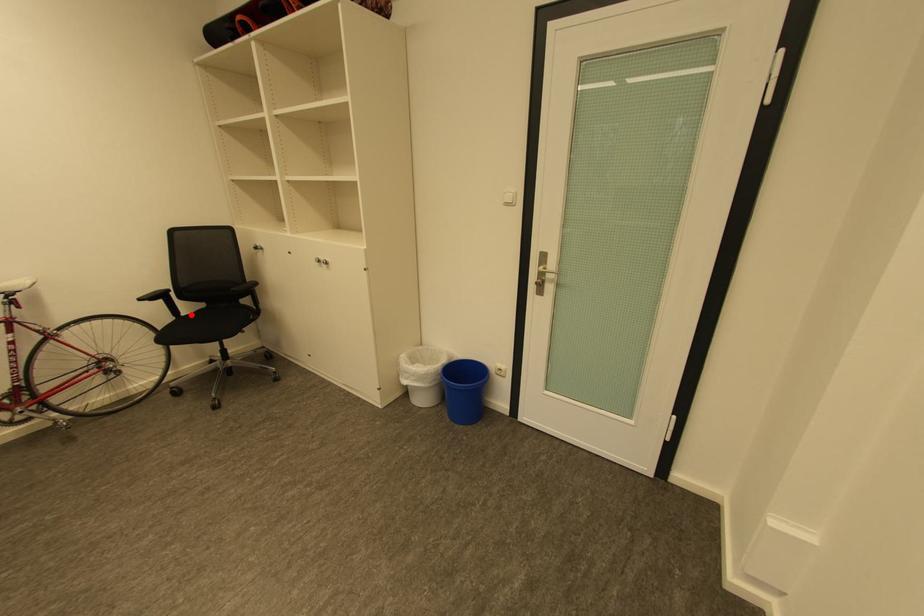
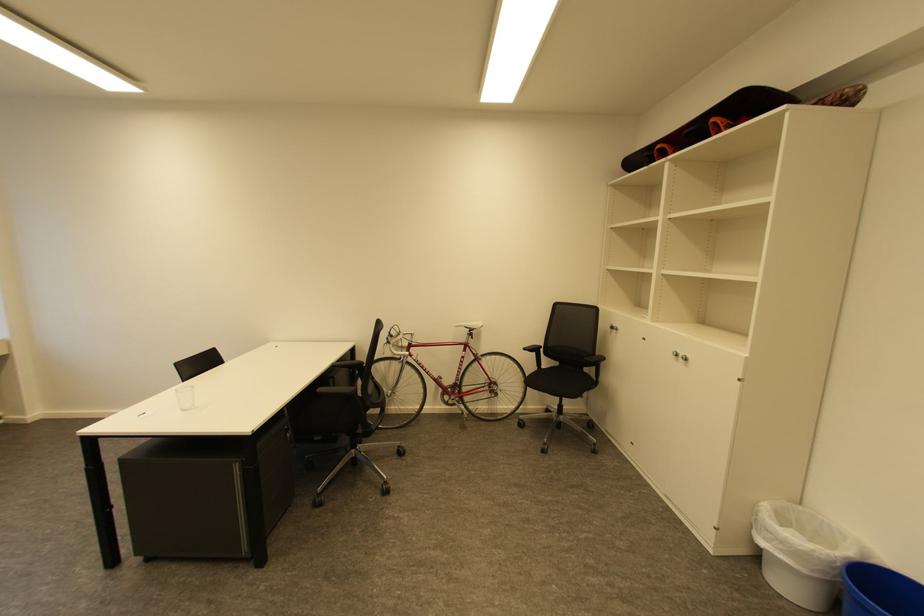
Question: I am providing you with two images of the same scene from different viewpoints. Given a red point in image1, look at the same physical point in image2. Is it:

Choices:
 (A) Closer to the viewpoint
 (B) Farther from the viewpoint

Answer: (B)